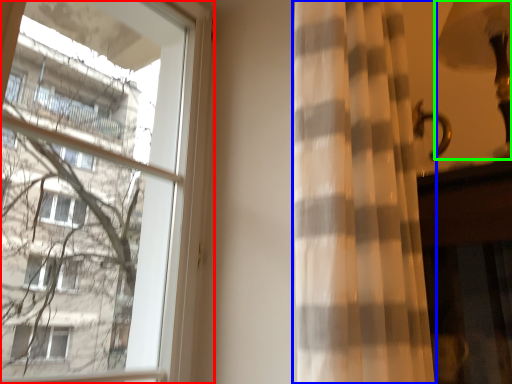
Question: Which is farther away from window (highlighted by a red box)? curtain (highlighted by a blue box) or table lamp (highlighted by a green box)?

Choices:
 (A) curtain
 (B) table lamp

Answer: (B)